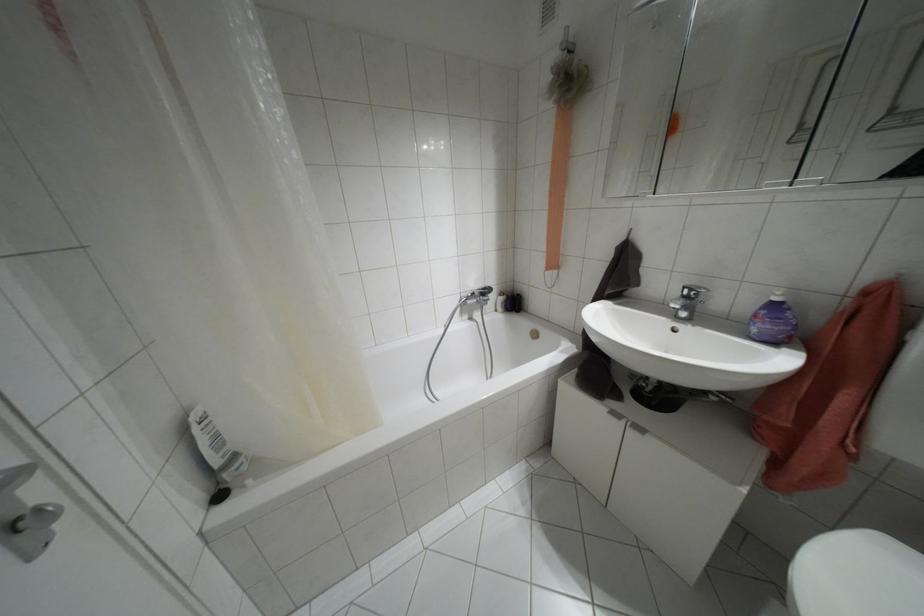
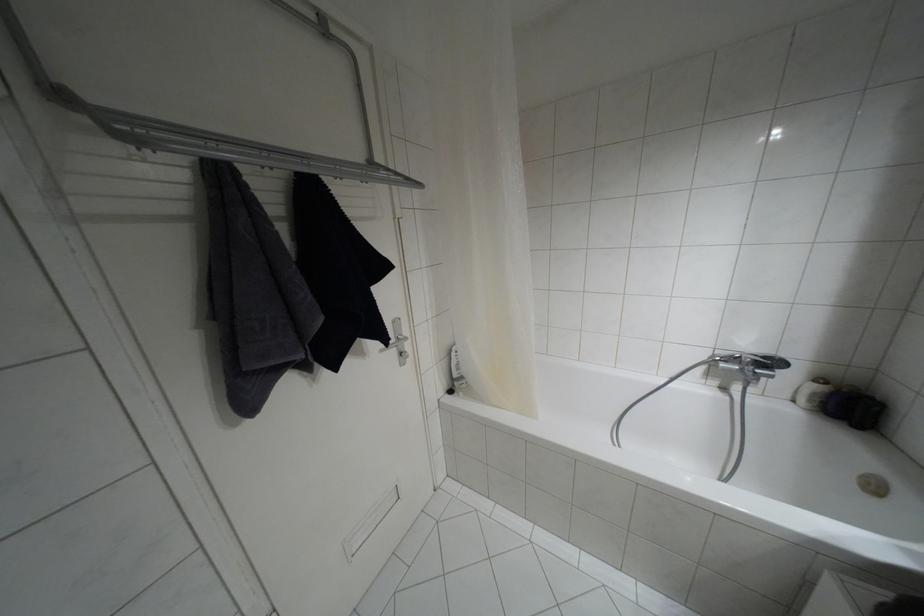
Where in the second image is the point corresponding to (482,288) from the first image?

(763, 357)